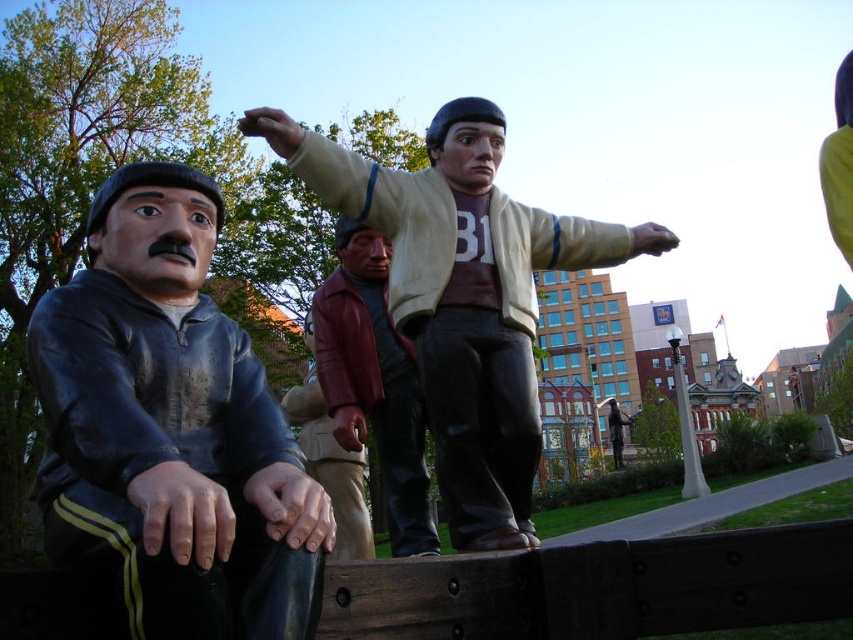
You are an artist planning to place a new sculpture between the shiny black jacket at left and the shiny maroon jacket at center. The sculpture requires a space of 1.2 meters in width. Can the available space accommodate it?

The shiny black jacket at left is wider than the shiny maroon jacket at center. However, the description does not provide the exact width of either jacket or the space between them. Therefore, it is uncertain if the 1.2 meters requirement can be met.

You are standing at the camera position and want to take a photo of the statue at point (68, 449). The statue is 6 feet tall. If your camera has a maximum focus range of 30 feet, will you be able to focus on it?

The distance between the camera and point (68, 449) is 34.08 feet. Since the statue at point (68, 449) is 34.08 feet away and the camera can only focus up to 30 feet, you will not be able to focus on it.

You are a tour guide leading a group to the shiny maroon jacket at center from the shiny black jacket at left. Can you walk straight towards it without needing to detour around any obstacles?

The distance between the shiny black jacket at left and the shiny maroon jacket at center is 10.96 meters. Since there are no obstacles mentioned in the scene description, you can walk straight towards it without needing to detour around any obstacles.